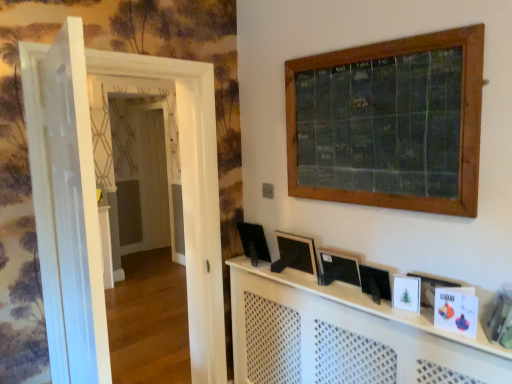
Question: Is black matte picture frame at center, which is counted as the 1th picture frame, starting from the left, further to the viewer compared to black plastic computer screen at center?

Choices:
 (A) yes
 (B) no

Answer: (B)

Question: Is black matte picture frame at center, marked as the third picture frame in a front-to-back arrangement, wider than black plastic computer screen at center?

Choices:
 (A) yes
 (B) no

Answer: (B)

Question: Is black matte picture frame at center, marked as the third picture frame in a front-to-back arrangement, positioned far away from black plastic computer screen at center?

Choices:
 (A) yes
 (B) no

Answer: (B)

Question: Is black plastic computer screen at center at the back of black matte picture frame at center, which is counted as the 1th picture frame, starting from the left?

Choices:
 (A) yes
 (B) no

Answer: (B)

Question: From the image's perspective, is black matte picture frame at center, marked as the 3th picture frame in a right-to-left arrangement, below black plastic computer screen at center?

Choices:
 (A) yes
 (B) no

Answer: (A)

Question: Does point (241, 233) appear closer or farther from the camera than point (136, 71)?

Choices:
 (A) farther
 (B) closer

Answer: (B)

Question: In terms of height, does black plastic computer screen at center look taller or shorter compared to white glossy door at left, which is counted as the 1th door, starting from the back?

Choices:
 (A) tall
 (B) short

Answer: (B)

Question: Visually, is black plastic computer screen at center positioned to the left or to the right of white glossy door at left, positioned as the 2th door in front-to-back order?

Choices:
 (A) right
 (B) left

Answer: (A)

Question: Is black plastic computer screen at center inside the boundaries of white glossy door at left, which is counted as the 1th door, starting from the back, or outside?

Choices:
 (A) outside
 (B) inside

Answer: (A)

Question: Is white perforated wood at center in front of or behind black matte picture frame at center, the second picture frame from the left, in the image?

Choices:
 (A) front
 (B) behind

Answer: (A)

Question: Do you think white perforated wood at center is within black matte picture frame at center, which is the second picture frame from right to left, or outside of it?

Choices:
 (A) outside
 (B) inside

Answer: (A)

Question: Would you say white perforated wood at center is to the left or to the right of black matte picture frame at center, the second picture frame from the left, in the picture?

Choices:
 (A) right
 (B) left

Answer: (B)

Question: Is white perforated wood at center wider or thinner than black matte picture frame at center, the second picture frame in the back-to-front sequence?

Choices:
 (A) thin
 (B) wide

Answer: (B)

Question: From a real-world perspective, is white matte picture frame at lower right, which ranks as the 1th picture frame in right-to-left order, above or below black plastic computer screen at center?

Choices:
 (A) below
 (B) above

Answer: (A)

Question: Is point (415, 306) closer or farther from the camera than point (246, 241)?

Choices:
 (A) closer
 (B) farther

Answer: (A)